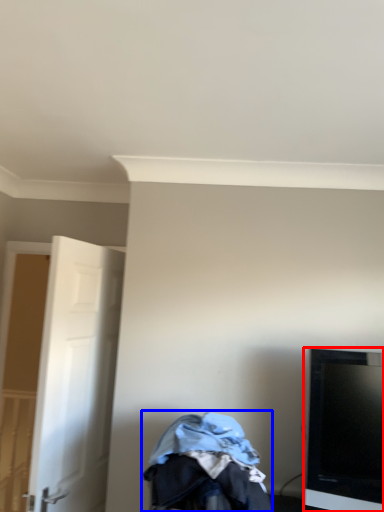
Question: Which object appears farthest to the camera in this image, television (highlighted by a red box) or baby carriage (highlighted by a blue box)?

Choices:
 (A) television
 (B) baby carriage

Answer: (A)